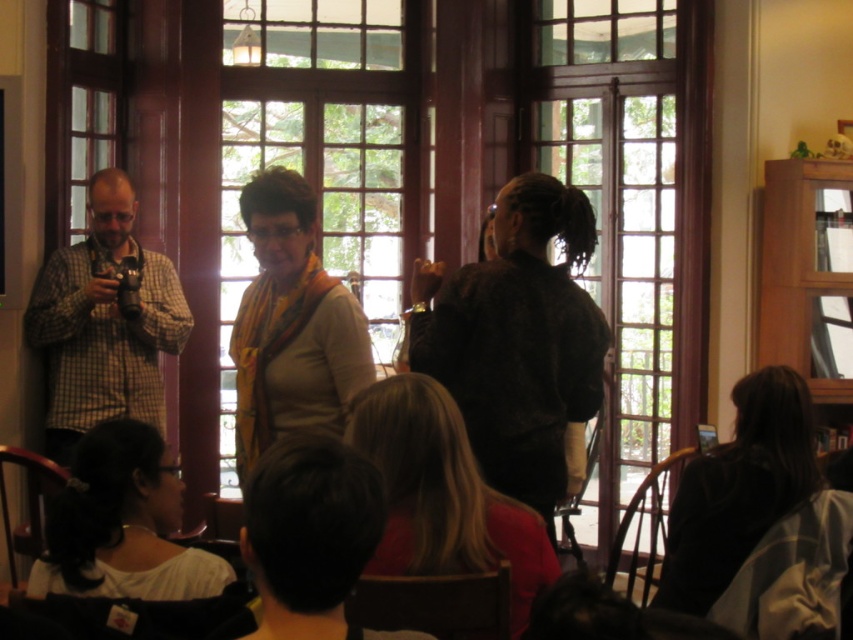
You are standing in the room and want to locate the matte yellow scarf at center. According to the coordinates provided, where would you find it?

The matte yellow scarf at center is located at the coordinates point (291, 324).

You are a photographer in the room and want to take a photo of the checkered fabric shirt at left and dark brown hair at lower right. To ensure both are in the frame, should you position your camera to the left or right side of the room?

You should position your camera to the right side of the room. Since the checkered fabric shirt at left is to the left of dark brown hair at lower right, placing the camera on the right side will allow both subjects to be captured within the frame.